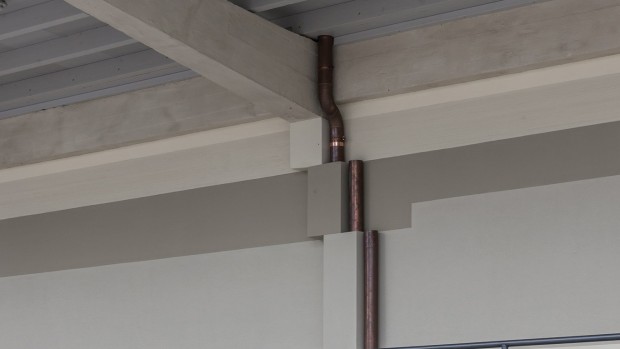
What are the coordinates of `molding` in the screenshot? It's located at (495, 77), (221, 132).